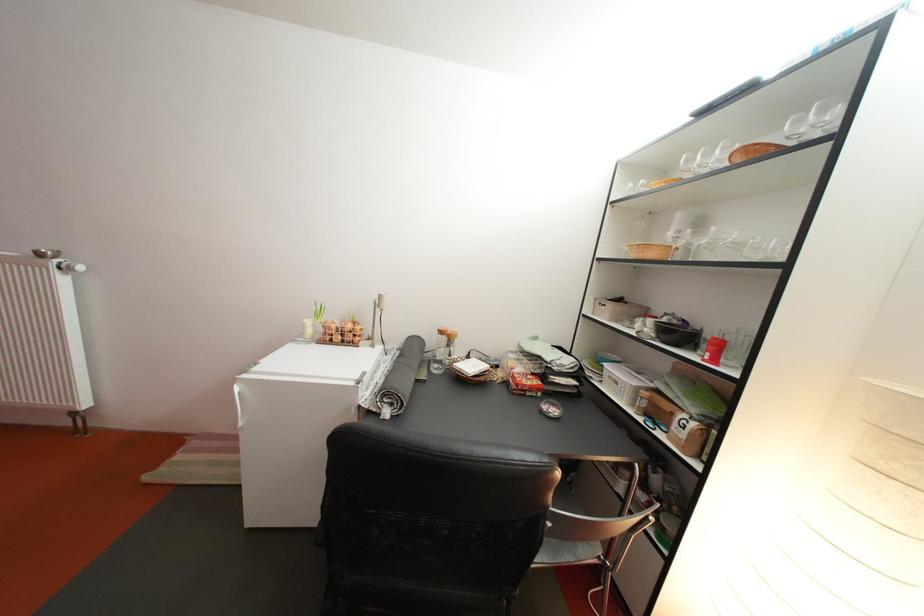
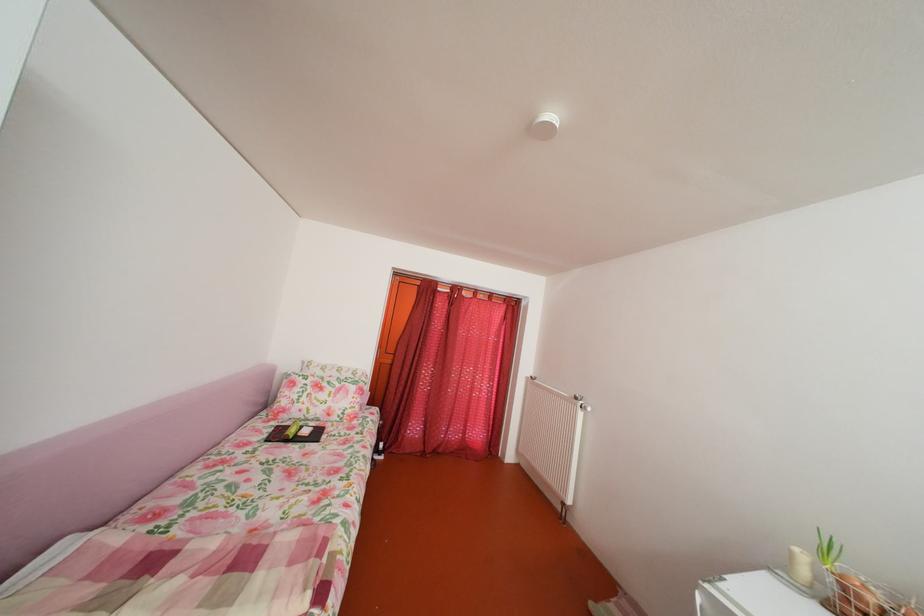
In the second image, find the point that corresponds to (341,334) in the first image.

(871, 605)